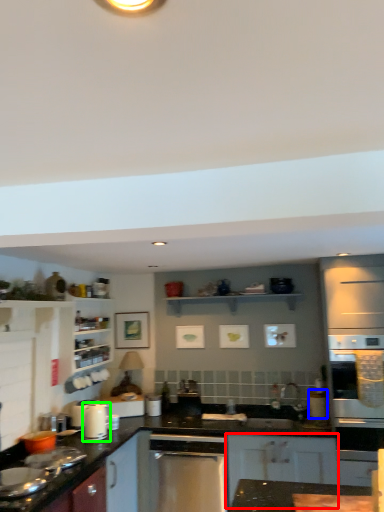
Question: Which object is the farthest from cabinetry (highlighted by a red box)? Choose among these: appliance (highlighted by a blue box) or kitchen appliance (highlighted by a green box).

Choices:
 (A) appliance
 (B) kitchen appliance

Answer: (B)